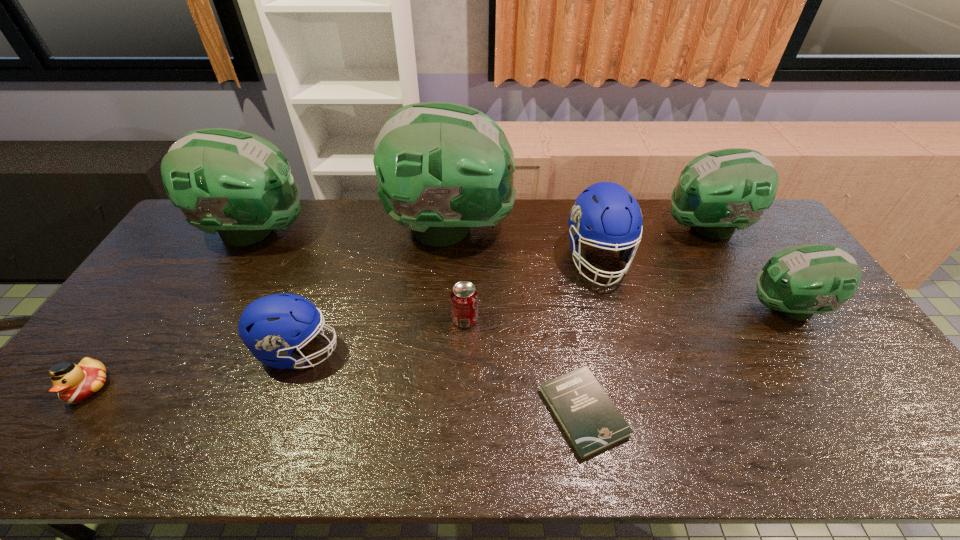
Find the location of `vacant space located 0.130m on the front-facing side of the bigger blue football helmet`. vacant space located 0.130m on the front-facing side of the bigger blue football helmet is located at coordinates (616, 326).

Locate an element on the screen. This screenshot has width=960, height=540. vacant region located on the visor of the nearest green football helmet is located at coordinates (653, 308).

At what (x,y) coordinates should I click in order to perform the action: click on free region located 0.290m on the visor of the nearest green football helmet. Please return your answer as a coordinate pair (x, y). The height and width of the screenshot is (540, 960). Looking at the image, I should click on (650, 308).

Where is `free space located on the visor of the nearest green football helmet`? This screenshot has height=540, width=960. free space located on the visor of the nearest green football helmet is located at coordinates (721, 308).

Locate an element on the screen. free region located 0.190m on the front-facing side of the left blue football helmet is located at coordinates (411, 351).

Find the location of a particular element. vacant space located on the back of the soda can is located at coordinates (468, 246).

In order to click on free space located 0.120m on the face of the red duck in this screenshot , I will do `click(38, 457)`.

Locate an element on the screen. vacant space positioned on the left of the dark book is located at coordinates (471, 412).

At what (x,y) coordinates should I click in order to perform the action: click on object that is at the near edge. Please return your answer as a coordinate pair (x, y). Image resolution: width=960 pixels, height=540 pixels. Looking at the image, I should click on (591, 421).

Identify the location of football helmet present at the left edge. (238, 184).